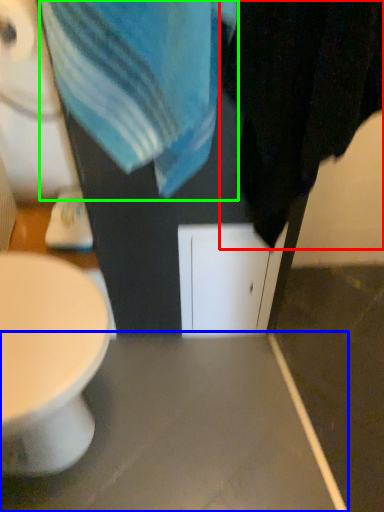
Question: Which is nearer to the bath towel (highlighted by a red box)? table (highlighted by a blue box) or beach towel (highlighted by a green box).

Choices:
 (A) table
 (B) beach towel

Answer: (B)